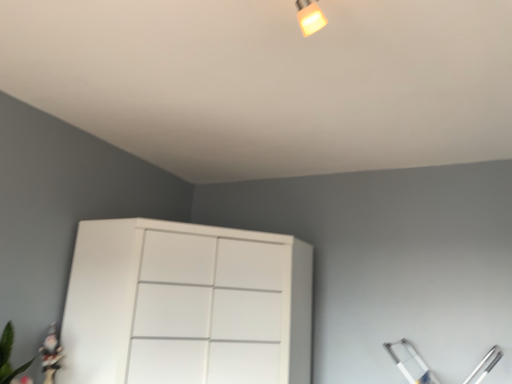
Image resolution: width=512 pixels, height=384 pixels. What do you see at coordinates (186, 305) in the screenshot?
I see `white matte cabinet at center` at bounding box center [186, 305].

What is the approximate width of white matte cabinet at center?

white matte cabinet at center is 3.60 feet wide.

The image size is (512, 384). I want to click on white matte cabinet at center, so click(x=186, y=305).

This screenshot has height=384, width=512. Find the location of `white matte cabinet at center`. white matte cabinet at center is located at coordinates (186, 305).